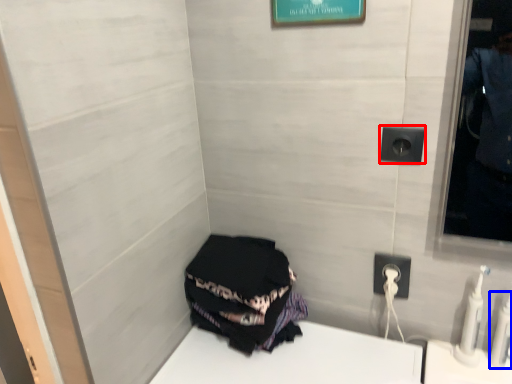
Question: Which object is further to the camera taking this photo, electric outlet (highlighted by a red box) or toiletry (highlighted by a blue box)?

Choices:
 (A) electric outlet
 (B) toiletry

Answer: (A)